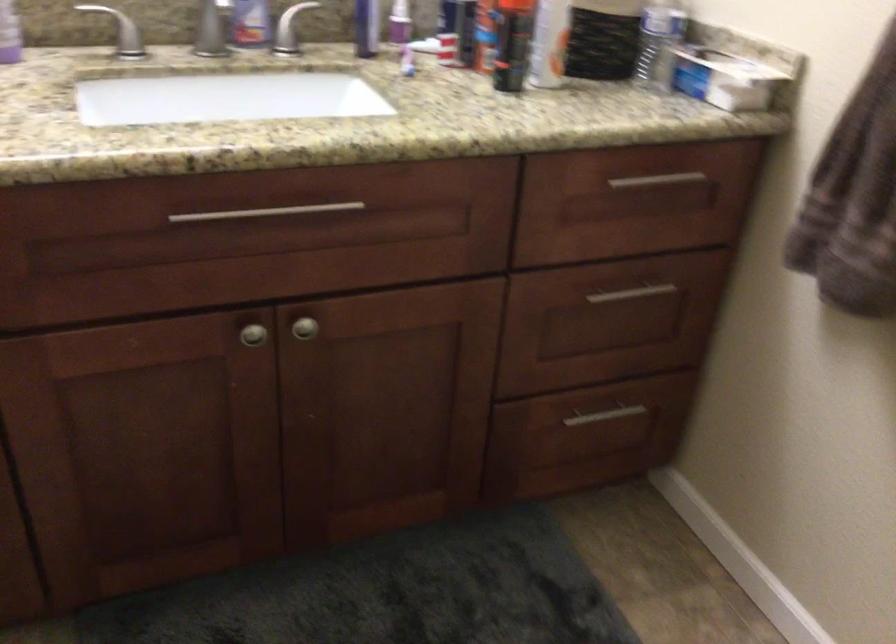
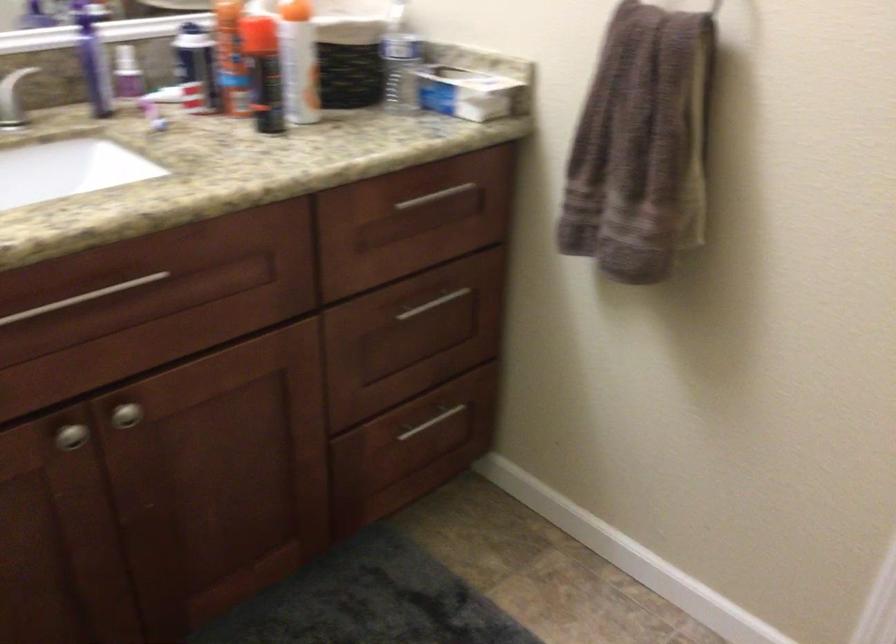
In the second image, find the point that corresponds to pixel 667 190 in the first image.

(445, 201)